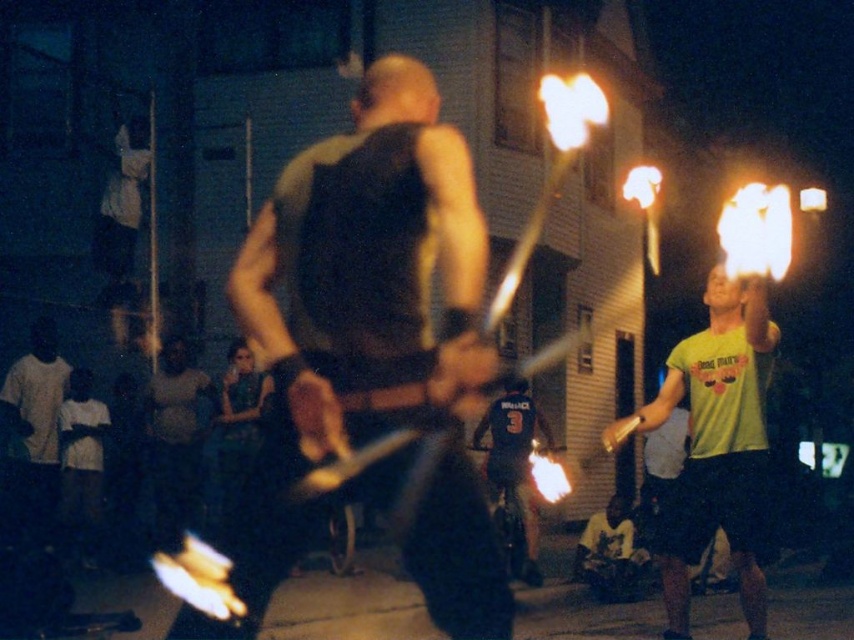
Question: Which is farther from the dark blue jersey at center?

Choices:
 (A) dark gray tank top at center
 (B) green matte t-shirt at right

Answer: (B)

Question: Is dark gray tank top at center above dark blue jersey at center?

Choices:
 (A) yes
 (B) no

Answer: (A)

Question: Which object is closer to the camera taking this photo?

Choices:
 (A) green matte t-shirt at right
 (B) dark gray tank top at center

Answer: (B)

Question: Which of these objects is positioned closest to the dark blue jersey at center?

Choices:
 (A) dark gray tank top at center
 (B) green matte t-shirt at right

Answer: (A)

Question: Is green matte t-shirt at right positioned behind dark blue jersey at center?

Choices:
 (A) yes
 (B) no

Answer: (B)

Question: From the image, what is the correct spatial relationship of dark gray tank top at center in relation to dark blue jersey at center?

Choices:
 (A) left
 (B) right

Answer: (A)